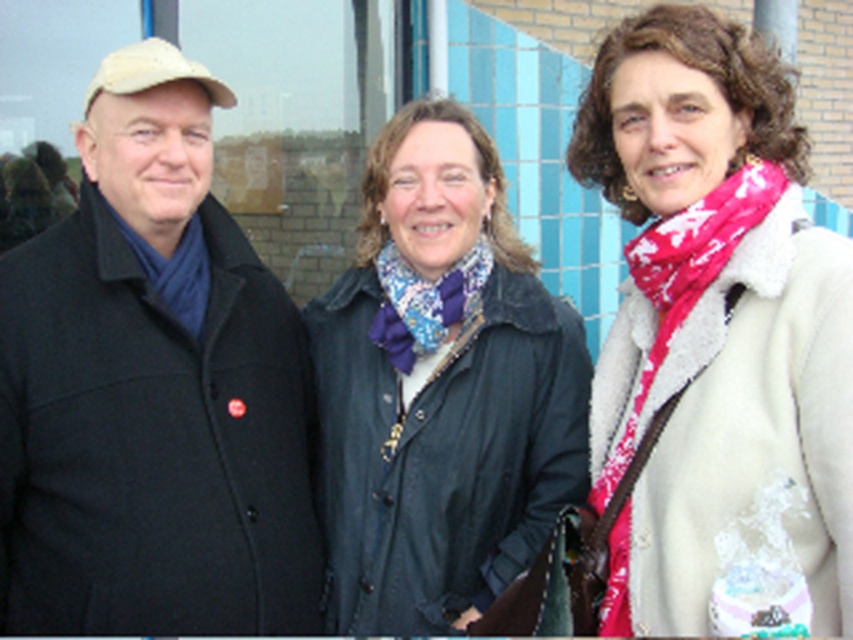
Can you confirm if black wool coat at left is thinner than pink printed scarf at center?

Incorrect, black wool coat at left's width is not less than pink printed scarf at center's.

Is point (115, 406) behind point (653, 589)?

Yes, point (115, 406) is behind point (653, 589).

Where is `black wool coat at left`? The height and width of the screenshot is (640, 853). black wool coat at left is located at coordinates tap(152, 388).

Looking at this image, who is more distant from viewer, (753, 276) or (450, 140)?

Positioned behind is point (450, 140).

Is pink printed scarf at center above blue textured scarf at center?

Indeed, pink printed scarf at center is positioned over blue textured scarf at center.

Is point (788, 276) positioned before point (415, 141)?

Yes, point (788, 276) is in front of point (415, 141).

The height and width of the screenshot is (640, 853). What are the coordinates of `pink printed scarf at center` in the screenshot? It's located at (717, 340).

Between black wool coat at left and blue textured scarf at center, which one appears on the right side from the viewer's perspective?

blue textured scarf at center is more to the right.

Between point (158, 509) and point (531, 428), which one is positioned in front?

Positioned in front is point (158, 509).

Locate an element on the screen. The width and height of the screenshot is (853, 640). black wool coat at left is located at coordinates (152, 388).